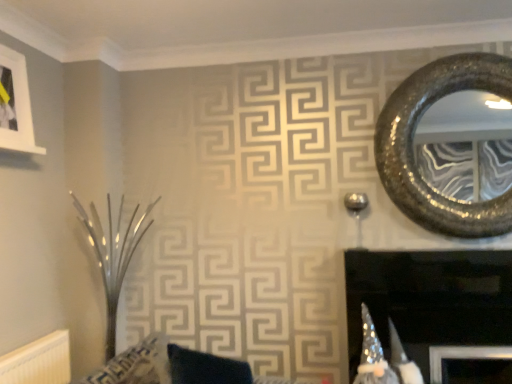
Question: Does white textured radiator at lower left have a lesser width compared to black glossy fireplace at center?

Choices:
 (A) no
 (B) yes

Answer: (B)

Question: Is black glossy fireplace at center surrounded by white textured radiator at lower left?

Choices:
 (A) yes
 (B) no

Answer: (B)

Question: From a real-world perspective, is white textured radiator at lower left located beneath black glossy fireplace at center?

Choices:
 (A) no
 (B) yes

Answer: (B)

Question: Does white textured radiator at lower left have a greater width compared to black glossy fireplace at center?

Choices:
 (A) no
 (B) yes

Answer: (A)

Question: Can you confirm if white textured radiator at lower left is positioned to the left of black glossy fireplace at center?

Choices:
 (A) no
 (B) yes

Answer: (B)

Question: In terms of width, does white textured radiator at lower left look wider or thinner when compared to black glossy fireplace at center?

Choices:
 (A) thin
 (B) wide

Answer: (A)

Question: Is point (57, 364) positioned closer to the camera than point (441, 264)?

Choices:
 (A) closer
 (B) farther

Answer: (A)

Question: Considering the positions of white textured radiator at lower left and black glossy fireplace at center in the image, is white textured radiator at lower left taller or shorter than black glossy fireplace at center?

Choices:
 (A) short
 (B) tall

Answer: (A)

Question: Is white textured radiator at lower left inside the boundaries of black glossy fireplace at center, or outside?

Choices:
 (A) inside
 (B) outside

Answer: (B)

Question: Considering the relative positions of velvet dark blue cushion at center and white matte picture frame at upper left in the image provided, is velvet dark blue cushion at center to the left or to the right of white matte picture frame at upper left?

Choices:
 (A) right
 (B) left

Answer: (A)

Question: From a real-world perspective, is velvet dark blue cushion at center above or below white matte picture frame at upper left?

Choices:
 (A) below
 (B) above

Answer: (A)

Question: Is point (232, 362) positioned closer to the camera than point (31, 147)?

Choices:
 (A) closer
 (B) farther

Answer: (A)

Question: Relative to white matte picture frame at upper left, is velvet dark blue cushion at center in front or behind?

Choices:
 (A) behind
 (B) front

Answer: (B)

Question: In terms of size, does white matte picture frame at upper left appear bigger or smaller than velvet dark blue cushion at center?

Choices:
 (A) small
 (B) big

Answer: (A)

Question: From their relative heights in the image, would you say white matte picture frame at upper left is taller or shorter than velvet dark blue cushion at center?

Choices:
 (A) short
 (B) tall

Answer: (B)